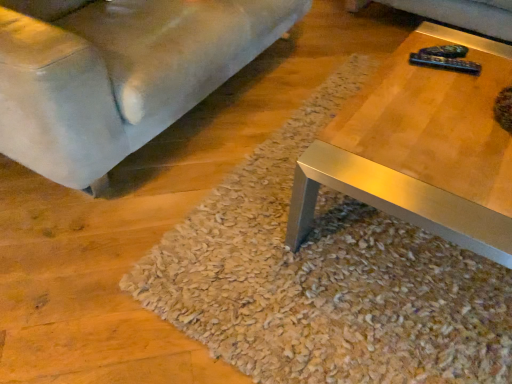
What is the approximate height of shaggy beige carpet at center?

2.29 inches.

What do you see at coordinates (325, 279) in the screenshot? This screenshot has width=512, height=384. I see `shaggy beige carpet at center` at bounding box center [325, 279].

In order to face shaggy beige carpet at center, should I rotate leftwards or rightwards?

You should look right and rotate roughly 17.105 degrees.

What is the approximate width of shaggy beige carpet at center?

5.88 feet.

Locate an element on the screen. This screenshot has height=384, width=512. shaggy beige carpet at center is located at coordinates (325, 279).

In order to face suede-like gray couch at lower left, should I rotate leftwards or rightwards?

Turn left by 15.476 degrees to look at suede-like gray couch at lower left.

You are a GUI agent. You are given a task and a screenshot of the screen. Output one action in this format:
    pyautogui.click(x=<x>, y=<y>)
    Task: Click on the suede-like gray couch at lower left
    This screenshot has height=384, width=512.
    Given the screenshot: What is the action you would take?
    (118, 74)

The width and height of the screenshot is (512, 384). Describe the element at coordinates (118, 74) in the screenshot. I see `suede-like gray couch at lower left` at that location.

Find the location of `shaggy beige carpet at center`. shaggy beige carpet at center is located at coordinates (325, 279).

Considering the positions of objects shaggy beige carpet at center and suede-like gray couch at lower left in the image provided, who is more to the right, shaggy beige carpet at center or suede-like gray couch at lower left?

shaggy beige carpet at center.

Which is behind, shaggy beige carpet at center or suede-like gray couch at lower left?

shaggy beige carpet at center is further from the camera.

Which point is more forward, (202, 301) or (236, 18)?

The point (202, 301) is closer.

From the image's perspective, does shaggy beige carpet at center appear higher than suede-like gray couch at lower left?

Actually, shaggy beige carpet at center appears below suede-like gray couch at lower left in the image.

From a real-world perspective, which object rests below the other?

shaggy beige carpet at center.

Which object is wider, shaggy beige carpet at center or suede-like gray couch at lower left?

With larger width is shaggy beige carpet at center.

Considering the sizes of shaggy beige carpet at center and suede-like gray couch at lower left in the image, is shaggy beige carpet at center taller or shorter than suede-like gray couch at lower left?

shaggy beige carpet at center is shorter than suede-like gray couch at lower left.

Which of these two, shaggy beige carpet at center or suede-like gray couch at lower left, is bigger?

suede-like gray couch at lower left is bigger.

Is suede-like gray couch at lower left a part of shaggy beige carpet at center?

No, suede-like gray couch at lower left is located outside of shaggy beige carpet at center.

Is shaggy beige carpet at center not near suede-like gray couch at lower left?

shaggy beige carpet at center is near suede-like gray couch at lower left, not far away.

Is suede-like gray couch at lower left at the back of shaggy beige carpet at center?

No.

How different are the orientations of shaggy beige carpet at center and suede-like gray couch at lower left in degrees?

91.3 degrees separate the facing orientations of shaggy beige carpet at center and suede-like gray couch at lower left.

What are the coordinates of `studio couch above the shaggy beige carpet at center (from a real-world perspective)` in the screenshot? It's located at (118, 74).

Considering the positions of objects suede-like gray couch at lower left and shaggy beige carpet at center in the image provided, who is more to the right, suede-like gray couch at lower left or shaggy beige carpet at center?

shaggy beige carpet at center is more to the right.

Is the depth of suede-like gray couch at lower left greater than that of shaggy beige carpet at center?

No, suede-like gray couch at lower left is in front of shaggy beige carpet at center.

Does point (122, 27) lie behind point (478, 372)?

Yes, point (122, 27) is behind point (478, 372).

From the image's perspective, which is above, suede-like gray couch at lower left or shaggy beige carpet at center?

suede-like gray couch at lower left appears higher in the image.

From a real-world perspective, is suede-like gray couch at lower left over shaggy beige carpet at center?

Yes, from a real-world perspective, suede-like gray couch at lower left is on top of shaggy beige carpet at center.

Is suede-like gray couch at lower left wider than shaggy beige carpet at center?

No.

Is suede-like gray couch at lower left shorter than shaggy beige carpet at center?

No, suede-like gray couch at lower left is not shorter than shaggy beige carpet at center.

Looking at this image, can you confirm if suede-like gray couch at lower left is smaller than shaggy beige carpet at center?

Actually, suede-like gray couch at lower left might be larger than shaggy beige carpet at center.

Choose the correct answer: Is suede-like gray couch at lower left inside shaggy beige carpet at center or outside it?

suede-like gray couch at lower left is outside shaggy beige carpet at center.

Is suede-like gray couch at lower left far away from shaggy beige carpet at center?

suede-like gray couch at lower left is near shaggy beige carpet at center, not far away.

Does suede-like gray couch at lower left turn towards shaggy beige carpet at center?

Yes, suede-like gray couch at lower left faces towards shaggy beige carpet at center.

How many degrees apart are the facing directions of suede-like gray couch at lower left and shaggy beige carpet at center?

The facing directions of suede-like gray couch at lower left and shaggy beige carpet at center are 91.3 degrees apart.

Find the location of `studio couch that is above the shaggy beige carpet at center (from a real-world perspective)`. studio couch that is above the shaggy beige carpet at center (from a real-world perspective) is located at coordinates (118, 74).

The width and height of the screenshot is (512, 384). Identify the location of studio couch above the shaggy beige carpet at center (from the image's perspective). (118, 74).

Locate an element on the screen. Image resolution: width=512 pixels, height=384 pixels. studio couch in front of the shaggy beige carpet at center is located at coordinates (118, 74).